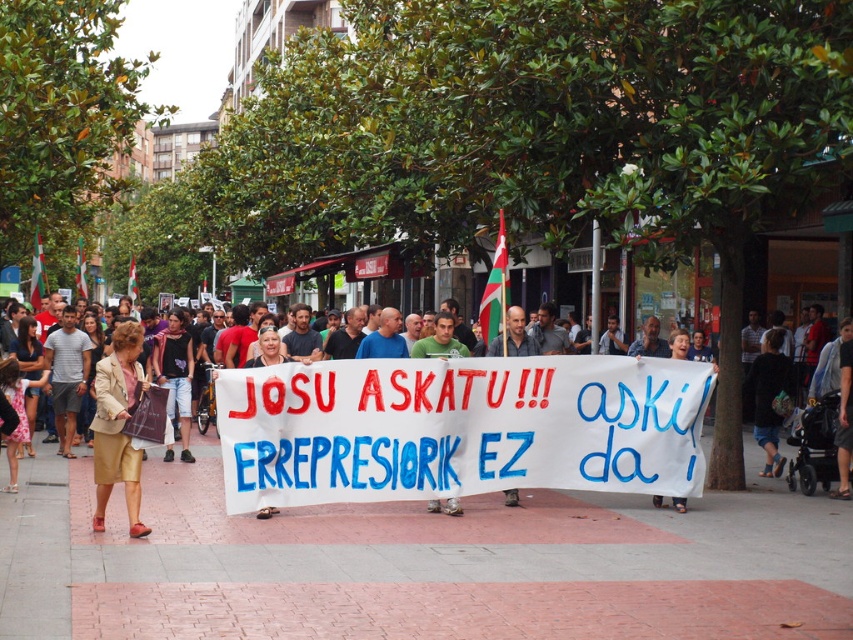
Based on the photo, can you confirm if gray concrete pavement at center is positioned to the left of gold fabric skirt at lower left?

No, gray concrete pavement at center is not to the left of gold fabric skirt at lower left.

Does gray concrete pavement at center appear under gold fabric skirt at lower left?

Indeed, gray concrete pavement at center is positioned under gold fabric skirt at lower left.

Is point (90, 536) farther from viewer compared to point (134, 381)?

No.

Locate an element on the screen. gray concrete pavement at center is located at coordinates (416, 564).

Is gray concrete pavement at center smaller than white fabric banner at center?

Incorrect, gray concrete pavement at center is not smaller in size than white fabric banner at center.

Which of these two, gray concrete pavement at center or white fabric banner at center, stands taller?

With more height is white fabric banner at center.

Does point (196, 570) lie behind point (549, 358)?

That is False.

You are a GUI agent. You are given a task and a screenshot of the screen. Output one action in this format:
    pyautogui.click(x=<x>, y=<y>)
    Task: Click on the gray concrete pavement at center
    
    Given the screenshot: What is the action you would take?
    pyautogui.click(x=416, y=564)

Is point (378, 404) less distant than point (132, 524)?

No, it is not.

Which of these two, white fabric banner at center or gold fabric skirt at lower left, stands taller?

Standing taller between the two is gold fabric skirt at lower left.

Which is behind, point (595, 388) or point (109, 356)?

Point (595, 388)

The image size is (853, 640). I want to click on white fabric banner at center, so click(x=459, y=428).